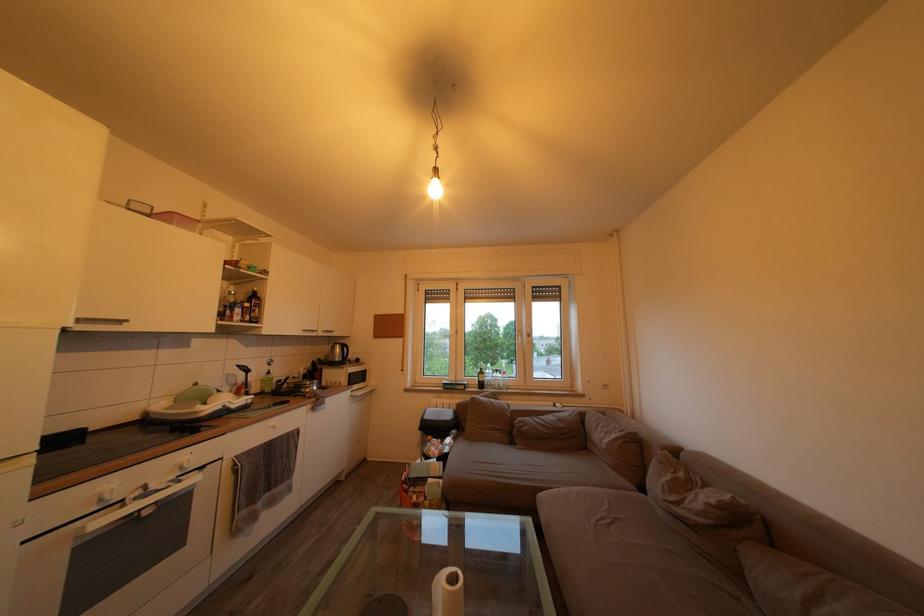
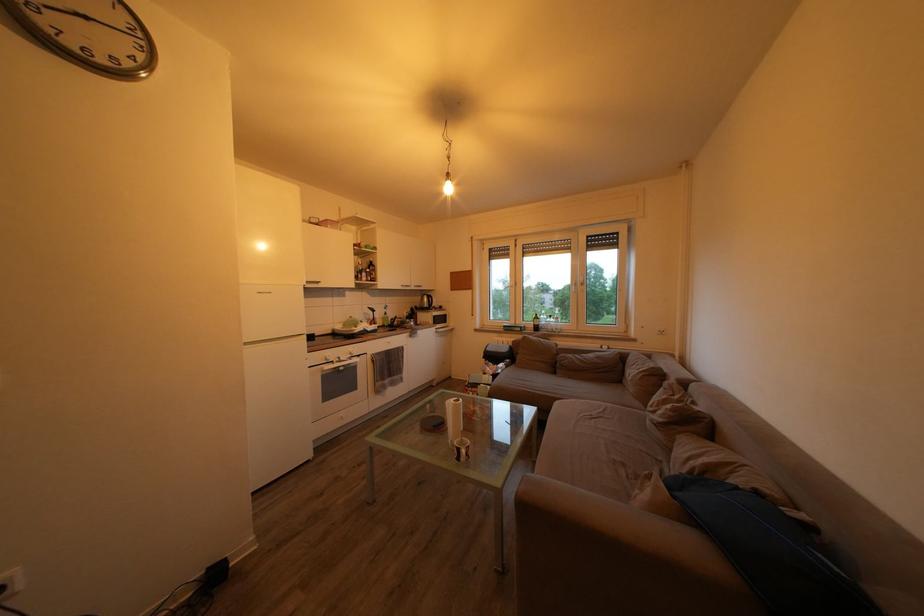
Locate, in the second image, the point that corresponds to point 254,377 in the first image.

(381, 317)